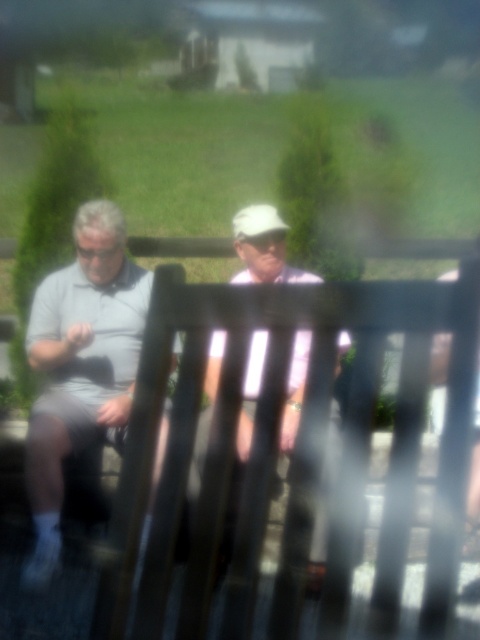
Question: Can you confirm if white matte shirt at center is positioned to the right of white matte baseball hat at center?

Choices:
 (A) no
 (B) yes

Answer: (A)

Question: Does gray matte shirt at left appear over white matte shirt at center?

Choices:
 (A) no
 (B) yes

Answer: (B)

Question: Which of the following is the farthest from the observer?

Choices:
 (A) white matte baseball hat at center
 (B) white matte shirt at center
 (C) gray matte shirt at left

Answer: (A)

Question: Which object appears farthest from the camera in this image?

Choices:
 (A) white matte shirt at center
 (B) gray matte shirt at left

Answer: (B)

Question: Among these points, which one is farthest from the camera?

Choices:
 (A) (282, 243)
 (B) (252, 211)
 (C) (39, 330)

Answer: (B)

Question: Does gray matte shirt at left appear on the left side of white matte shirt at center?

Choices:
 (A) no
 (B) yes

Answer: (B)